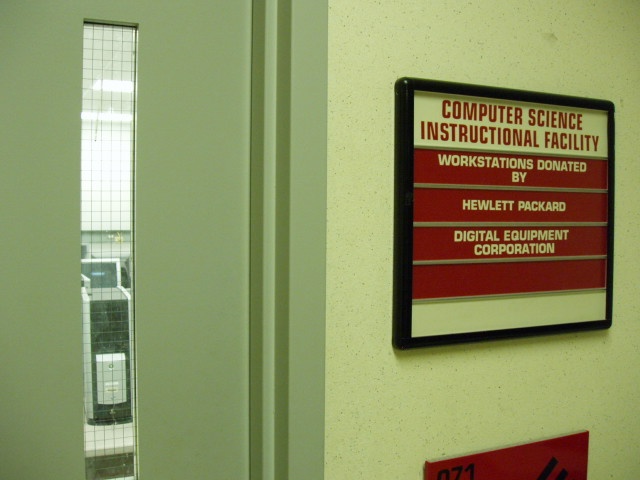
Find the location of a particular element. The image size is (640, 480). door is located at coordinates (219, 281).